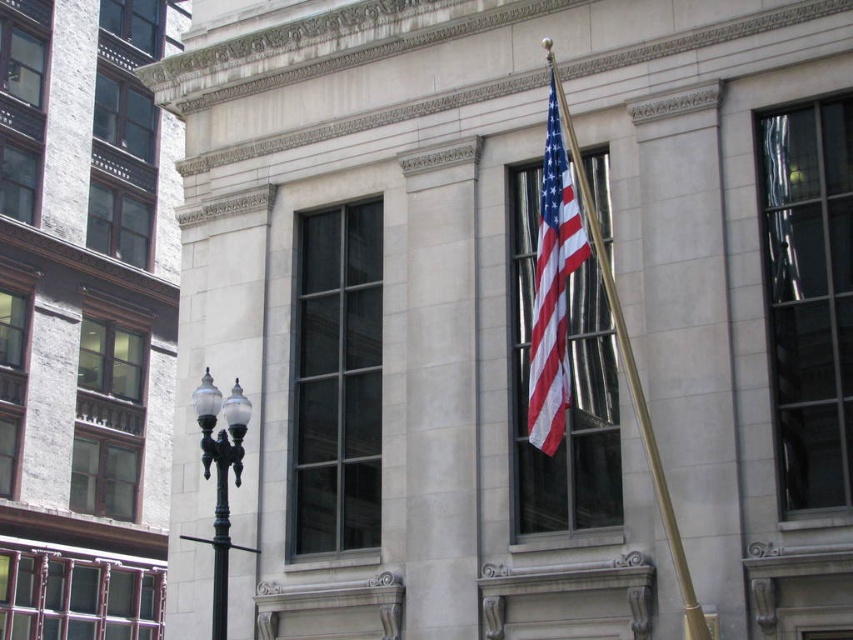
Question: Is american flag at center further to camera compared to polished black lamppost at lower left?

Choices:
 (A) no
 (B) yes

Answer: (A)

Question: Estimate the real-world distances between objects in this image. Which object is farther from the american flag at center?

Choices:
 (A) gold polished flag pole at center
 (B) polished black lamppost at lower left

Answer: (B)

Question: Which point is farther to the camera?

Choices:
 (A) gold polished flag pole at center
 (B) polished black lamppost at lower left

Answer: (B)

Question: Does american flag at center come behind gold polished flag pole at center?

Choices:
 (A) yes
 (B) no

Answer: (A)

Question: Is american flag at center thinner than gold polished flag pole at center?

Choices:
 (A) no
 (B) yes

Answer: (B)

Question: Which of the following is the farthest from the observer?

Choices:
 (A) (201, 404)
 (B) (573, 234)

Answer: (A)